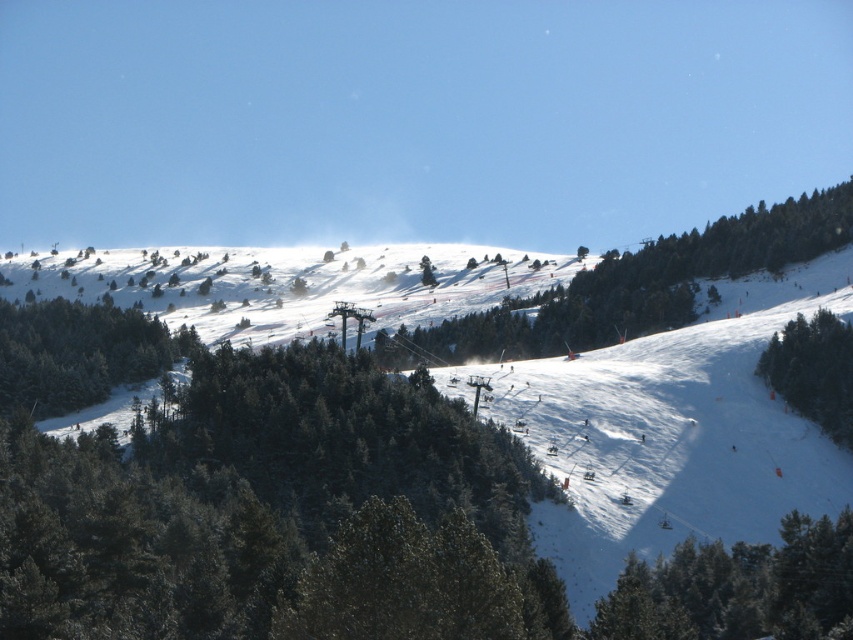
You are standing at the base of the mountain and want to walk towards the green matte tree at center. Which direction should you move relative to the green matte tree at lower right?

You should move to the right of the green matte tree at lower right because the green matte tree at center is positioned to the right of it.

You are a photographer standing at the bottom of the mountain and want to take a photo of two points on the slope. The first point is labeled as point (442, 276) and the second is point (33, 323). Which point will appear closer to the bottom of the mountain in your photo?

Point (33, 323) will appear closer to the bottom of the mountain in the photo because it is closer to the photographer than point (442, 276), which is further away.

You are a photographer standing at the lower right corner of the image. You want to take a photo that includes both the green matte tree at lower right and the green matte tree at right. Which tree will appear closer to the camera in the photo?

The green matte tree at lower right will appear closer to the camera because it is in front of the green matte tree at right.